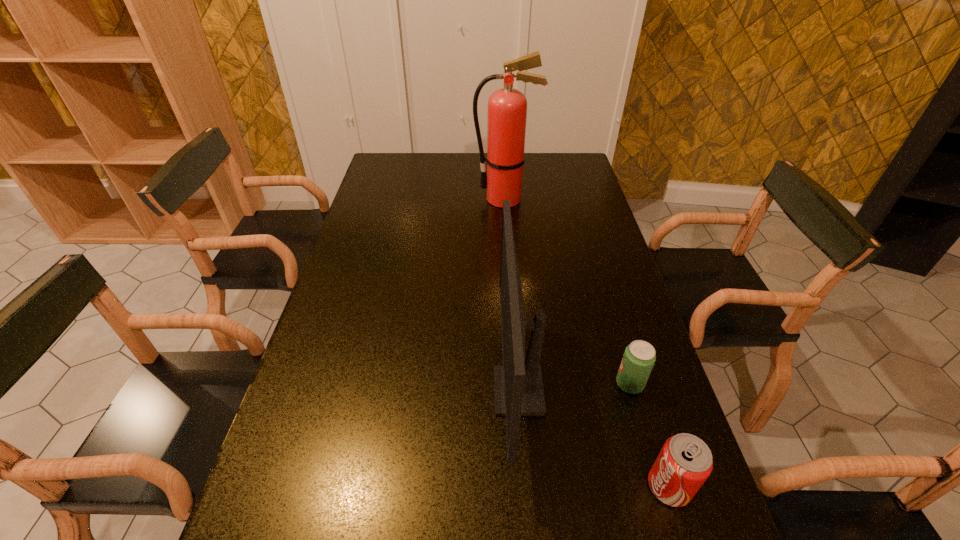
In order to click on the tallest object in this screenshot , I will do `click(507, 108)`.

The image size is (960, 540). Identify the location of the farthest object. pyautogui.click(x=507, y=108).

This screenshot has width=960, height=540. Identify the location of the second tallest object. (518, 386).

Locate an element on the screen. The image size is (960, 540). the nearer soda is located at coordinates (684, 463).

Where is `the shortest object`? the shortest object is located at coordinates (639, 357).

You are a GUI agent. You are given a task and a screenshot of the screen. Output one action in this format:
    pyautogui.click(x=<x>, y=<y>)
    Task: Click on the farther soda
    This screenshot has height=540, width=960.
    Given the screenshot: What is the action you would take?
    pyautogui.click(x=639, y=357)

At what (x,y) coordinates should I click in order to perform the action: click on free spot located 0.150m on the hose direction of the tallest object. Please return your answer as a coordinate pair (x, y). Looking at the image, I should click on (433, 199).

Find the location of a particular element. free space located 0.240m on the hose direction of the tallest object is located at coordinates (409, 199).

Identify the location of free space located on the hose direction of the tallest object. This screenshot has width=960, height=540. (396, 199).

Locate an element on the screen. The width and height of the screenshot is (960, 540). vacant space located on the front-facing side of the second tallest object is located at coordinates (348, 391).